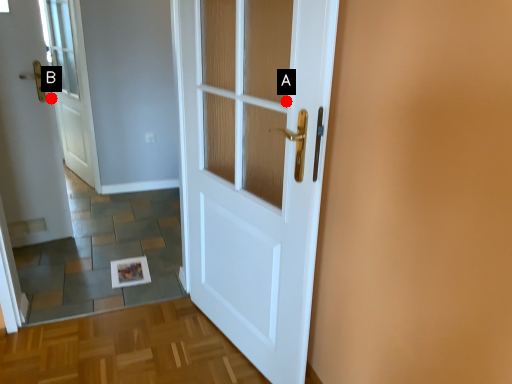
Question: Two points are circled on the image, labeled by A and B beside each circle. Which point is farther from the camera taking this photo?

Choices:
 (A) A is further
 (B) B is further

Answer: (B)